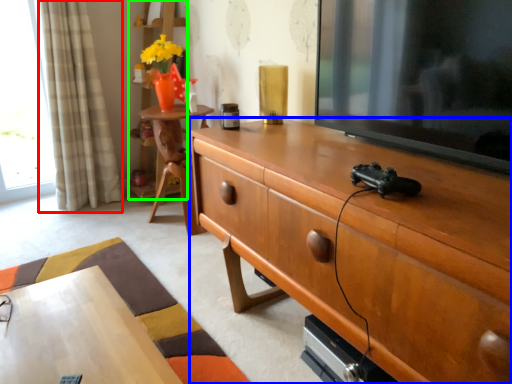
Question: Which is farther away from curtain (highlighted by a red box)? cabinetry (highlighted by a blue box) or bookshelf (highlighted by a green box)?

Choices:
 (A) cabinetry
 (B) bookshelf

Answer: (A)